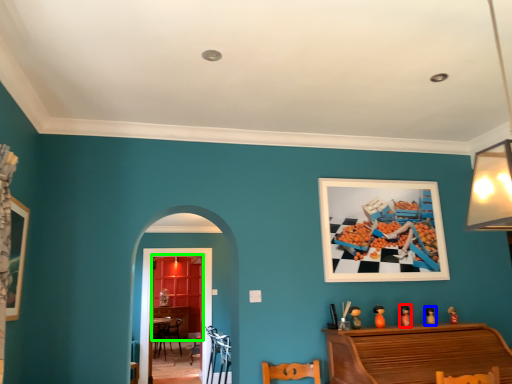
Question: Which object is positioned farthest from toy (highlighted by a red box)? Select from toy (highlighted by a blue box) and dresser (highlighted by a green box).

Choices:
 (A) toy
 (B) dresser

Answer: (B)